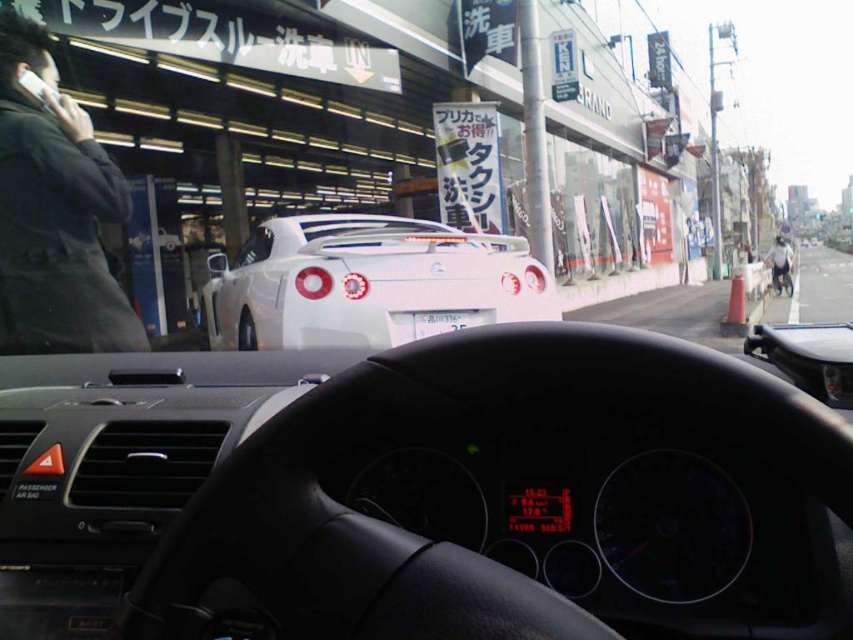
You are driving a car and want to know if the white glossy sports car at center can fit through a narrow alley that is as wide as the black plastic phone at upper left. Can it fit?

The white glossy sports car at center might be wider than black plastic phone at upper left, so it might not fit through the alley.

You are a passenger in the car and notice two items through the windshield. The white glossy license plate at center and the light gray fabric jacket at right. Which item is positioned closer to the left side of the windshield?

The white glossy license plate at center is positioned to the left of the light gray fabric jacket at right, so it is closer to the left side of the windshield.